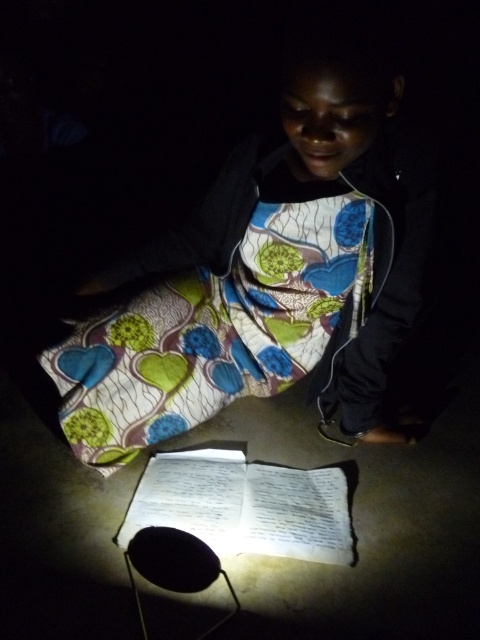
You are a photographer trying to capture the scene. Since both the printed fabric dress at center and the white paper book at center are in the center, how can you adjust your camera to ensure both are clearly visible in the photo?

Since the printed fabric dress at center is in front of the white paper book at center, you can adjust your camera focus to the white paper book at center to ensure it remains visible behind the dress.

You are a photographer trying to capture the scene. The printed fabric dress at center and the white paper book at center are both important subjects. Since the dress is covering the book, how can you ensure both are visible in your photo?

Since the printed fabric dress at center is positioned over the white paper book at center, you can lift the dress slightly to reveal the book underneath while keeping both items in frame.

Consider the image. You are a fashion designer observing the scene. You need to determine if the printed fabric dress at center can be folded and stored in the white paper book at center. Based on their sizes, what is your conclusion?

The printed fabric dress at center is much taller than the white paper book at center, so it cannot be folded and stored in the white paper book at center.